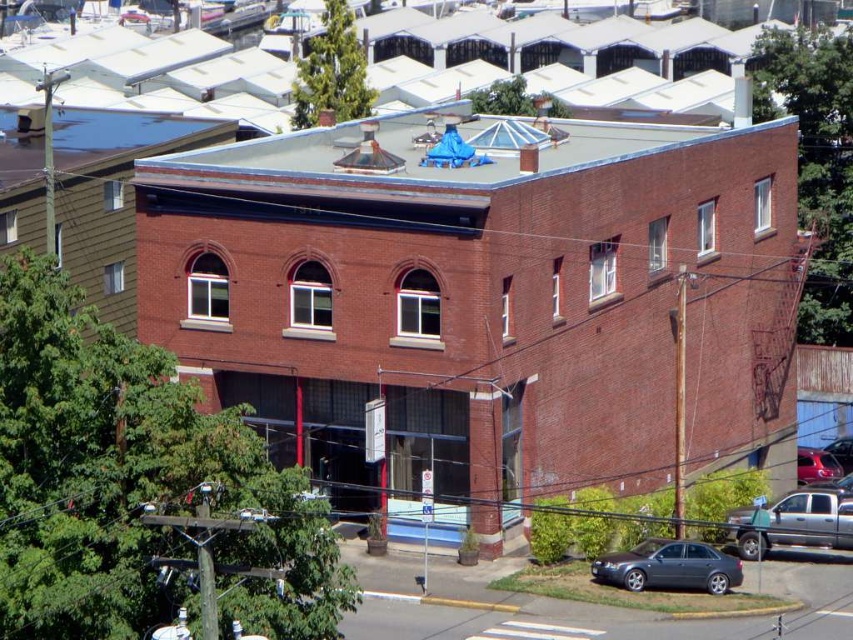
You are a delivery person who needs to park your van, which is 6 meters long, between the silver metallic truck at lower right and the shiny red car at lower right. Based on the image, can you fit your van there?

The distance between the silver metallic truck at lower right and the shiny red car at lower right is 14.67 meters. Since your van is 6 meters long, there is sufficient space to park it between them.

You are a delivery person trying to park your van in the parking spot next to the building. The parking spot is located between the metallic gray sedan at lower right and the shiny red car at lower right. Can your van fit between them if the van is 6 meters long?

The metallic gray sedan at lower right is larger than the shiny red car at lower right. However, the exact distance between them isn

In the scene shown: You are a delivery person needing to park your van next to the silver metallic truck at lower right. There is a metallic gray sedan at lower right blocking the spot. Can you move the sedan to the right to clear the parking space?

The metallic gray sedan at lower right is to the left of the silver metallic truck at lower right. Moving the sedan to the right would place it next to or behind the truck, thus clearing the parking space for your van.